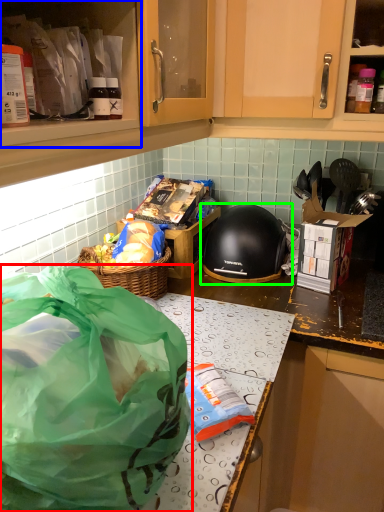
Question: Which is farther away from plastic bag (highlighted by a red box)? cabinetry (highlighted by a blue box) or helmet (highlighted by a green box)?

Choices:
 (A) cabinetry
 (B) helmet

Answer: (B)